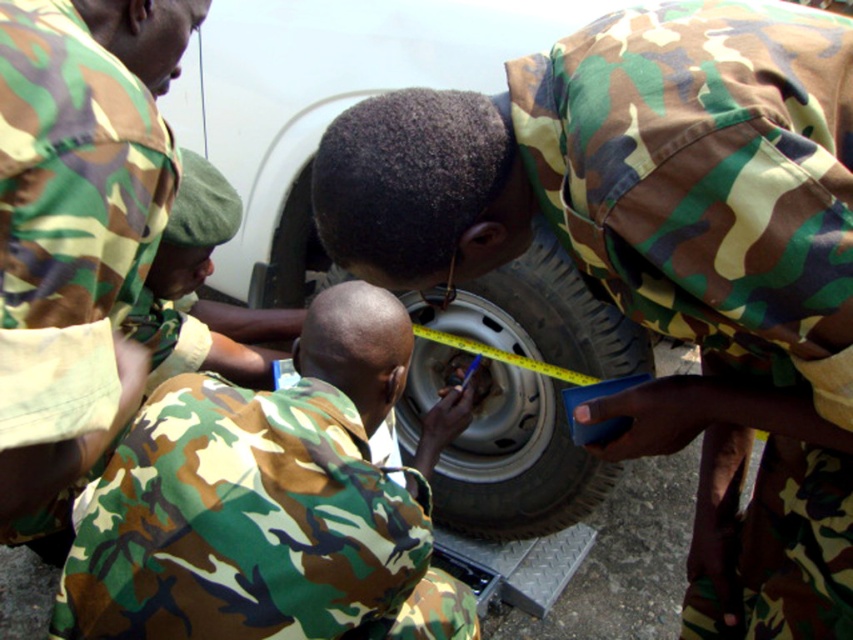
Question: Which point appears closest to the camera in this image?

Choices:
 (A) (112, 278)
 (B) (260, 420)
 (C) (544, 458)
 (D) (680, 4)

Answer: (A)

Question: Is camouflage fabric uniform at center to the right of camouflage fabric uniform at left from the viewer's perspective?

Choices:
 (A) no
 (B) yes

Answer: (B)

Question: Does camouflage fabric uniform at center have a larger size compared to camouflage fabric uniform at lower center?

Choices:
 (A) yes
 (B) no

Answer: (A)

Question: Considering the real-world distances, which object is farthest from the camouflage fabric uniform at left?

Choices:
 (A) camouflage fabric uniform at lower center
 (B) silver metallic wheel at center

Answer: (B)

Question: Can you confirm if camouflage fabric uniform at lower center is positioned to the left of silver metallic wheel at center?

Choices:
 (A) no
 (B) yes

Answer: (B)

Question: Which is farther from the camouflage fabric uniform at center?

Choices:
 (A) silver metallic wheel at center
 (B) camouflage fabric uniform at left

Answer: (A)